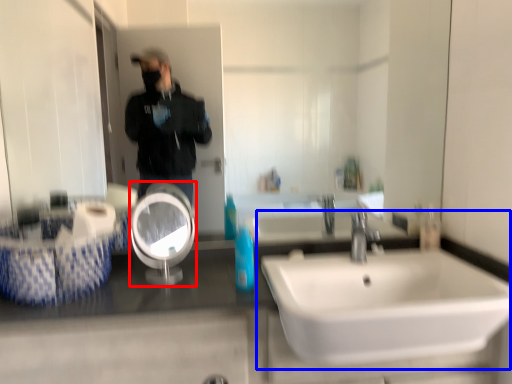
Question: Which point is closer to the camera, reflection (highlighted by a red box) or sink (highlighted by a blue box)?

Choices:
 (A) reflection
 (B) sink

Answer: (B)